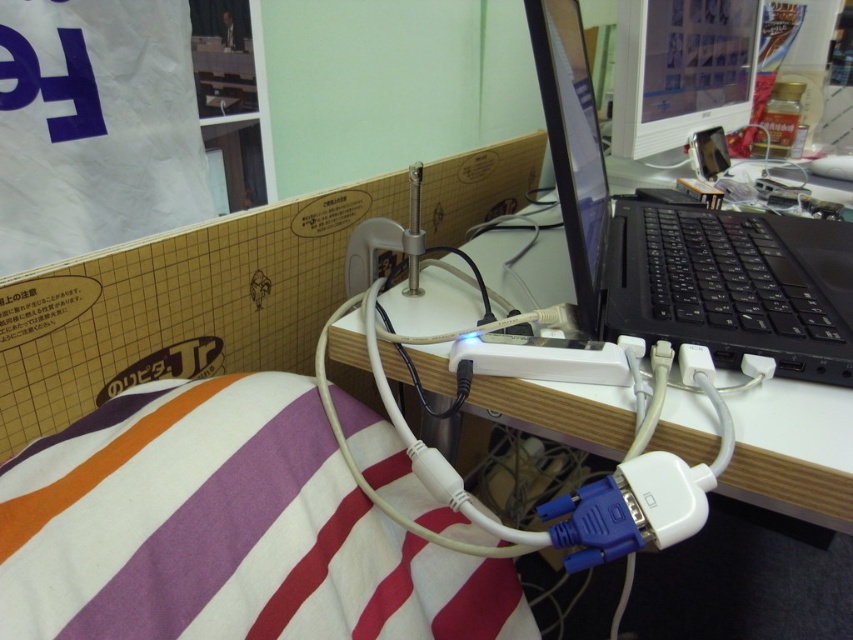
Is white striped blanket at lower left shorter than white plastic computer desk at center?

Correct, white striped blanket at lower left is not as tall as white plastic computer desk at center.

Between white striped blanket at lower left and white plastic computer desk at center, which one is positioned higher?

white plastic computer desk at center is higher up.

At what (x,y) coordinates should I click in order to perform the action: click on white striped blanket at lower left. Please return your answer as a coordinate pair (x, y). The height and width of the screenshot is (640, 853). Looking at the image, I should click on (223, 531).

Does point (306, 589) come closer to viewer compared to point (726, 67)?

Yes, point (306, 589) is in front of point (726, 67).

Is point (370, 429) positioned after point (688, 81)?

No, it is not.

Between point (148, 577) and point (634, 72), which one is positioned in front?

Positioned in front is point (148, 577).

Locate an element on the screen. white striped blanket at lower left is located at coordinates point(223,531).

Is point (338, 337) closer to camera compared to point (701, 38)?

Yes, it is in front of point (701, 38).

Between point (514, 256) and point (730, 65), which one is positioned in front?

Positioned in front is point (514, 256).

Find the location of a particular element. Image resolution: width=853 pixels, height=640 pixels. white plastic computer desk at center is located at coordinates (792, 484).